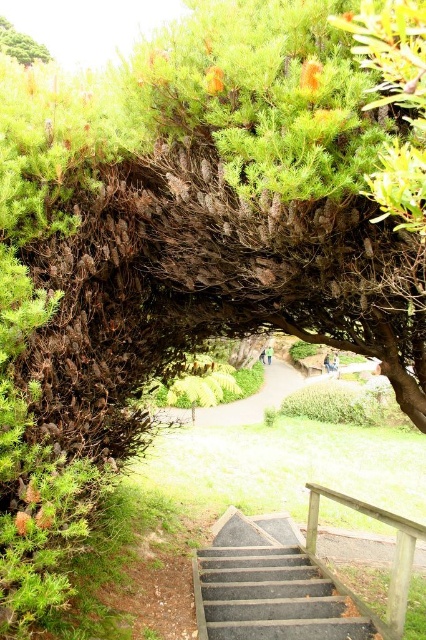
Question: Which point is farther to the camera?

Choices:
 (A) (313, 499)
 (B) (11, 28)

Answer: (B)

Question: Does green grassy path at center appear under green leafy tree at upper left?

Choices:
 (A) yes
 (B) no

Answer: (A)

Question: Is dark gray concrete stairs at center in front of wooden rail at center?

Choices:
 (A) no
 (B) yes

Answer: (A)

Question: Which object appears farthest from the camera in this image?

Choices:
 (A) green leafy tree at upper left
 (B) dark gray concrete stairs at center
 (C) wooden rail at center

Answer: (A)

Question: Among these points, which one is nearest to the camera?

Choices:
 (A) (9, 35)
 (B) (357, 506)

Answer: (B)

Question: Is wooden rail at center below green leafy tree at upper left?

Choices:
 (A) no
 (B) yes

Answer: (B)